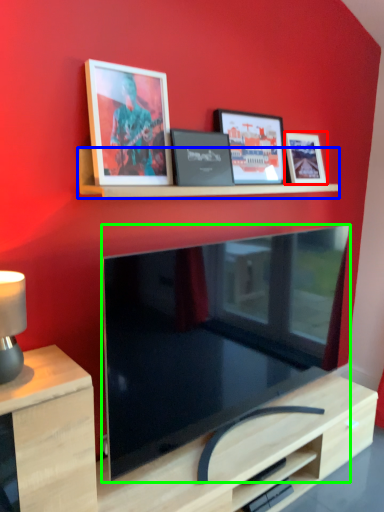
Question: Estimate the real-world distances between objects in this image. Which object is closer to picture frame (highlighted by a red box), shelf (highlighted by a blue box) or television (highlighted by a green box)?

Choices:
 (A) shelf
 (B) television

Answer: (A)